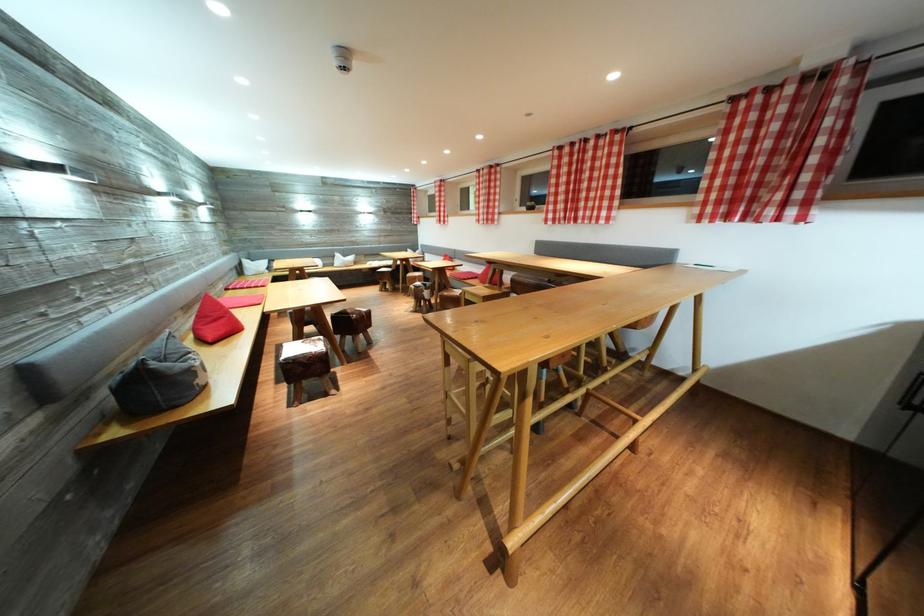
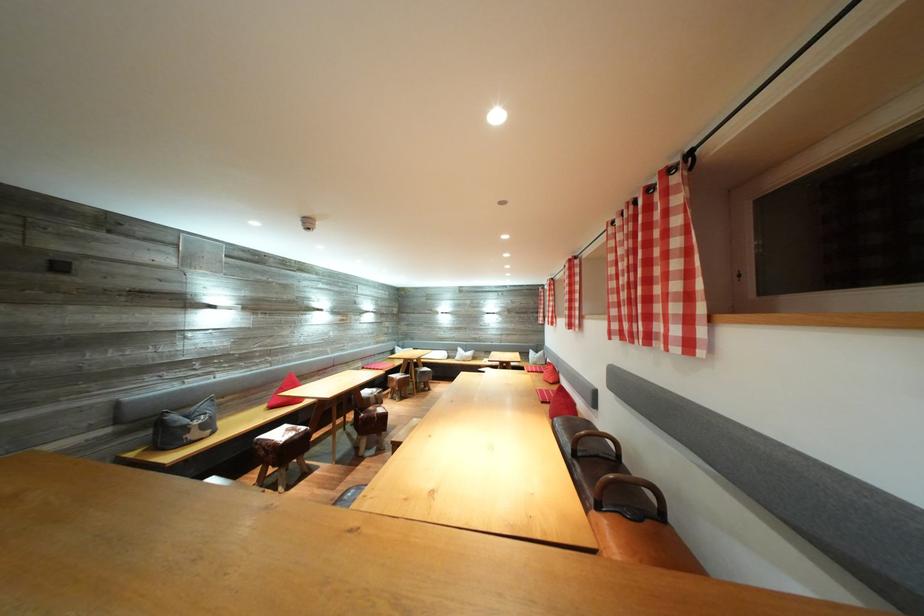
Where in the second image is the point corresponding to (345,261) from the first image?

(467, 355)